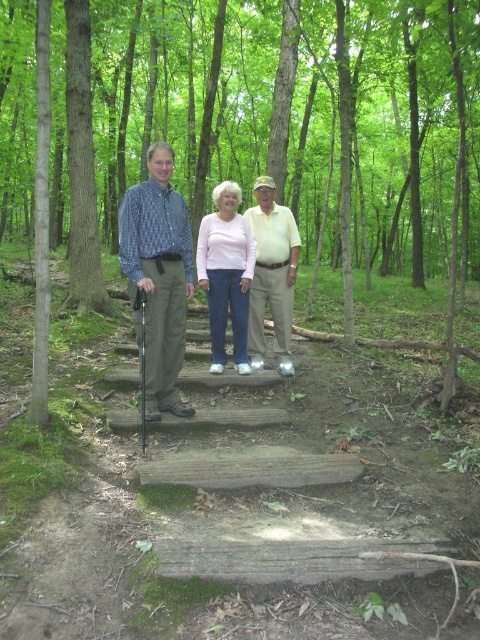
You are a photographer planning to take a group photo of the khaki cotton pants at center and the weathered wooden bench at center. Which object should you place closer to the camera to ensure both appear equally sized in the photo?

Since the khaki cotton pants at center is larger in size than the weathered wooden bench at center, you should place the weathered wooden bench at center closer to the camera to make them appear the same size in the photo.

You are a photographer standing at the camera position. You want to focus on the two points in the image labeled as point (165,388) and point (277,301). Which point should you adjust your focus to first if you want to capture the closest one to the camera?

Point (165,388) is closer to the camera than point (277,301), so you should adjust your focus to point (165,388) first.

You are a photographer trying to capture a group photo of the three people on the wooden steps in the forest. You notice a specific point marked at coordinates (157, 280). Which person should you focus on to ensure they are centered in your shot?

The point at (157, 280) indicates the matte blue shirt at center, so you should focus on the person wearing the matte blue shirt at center to ensure they are centered in your shot.